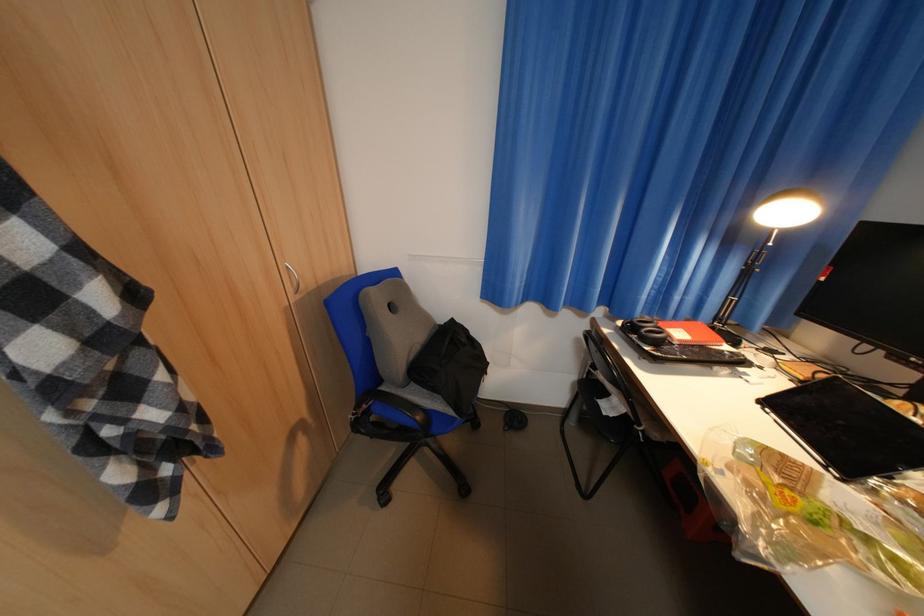
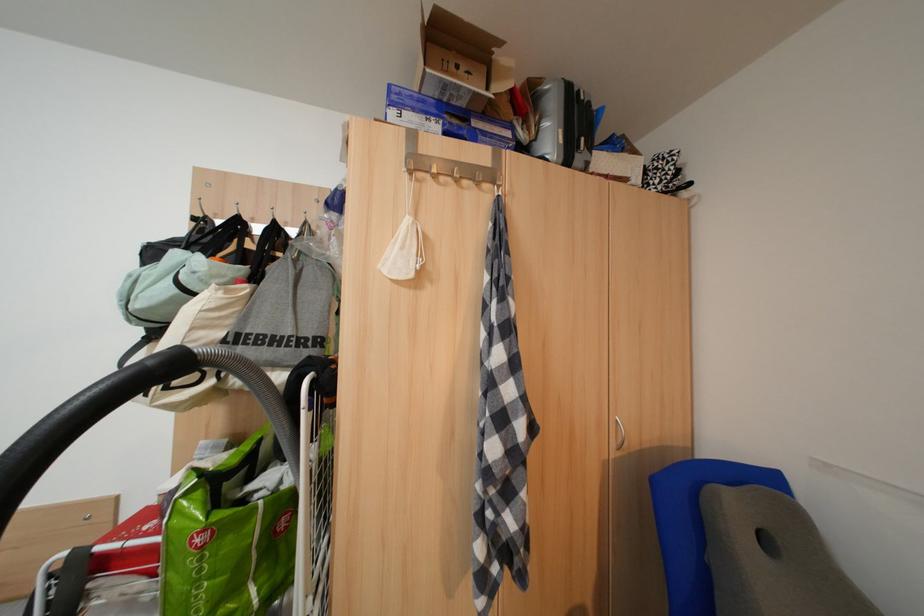
Question: The first image is from the beginning of the video and the second image is from the end. How did the camera likely rotate when shooting the video?

Choices:
 (A) Left
 (B) Right
 (C) Up
 (D) Down

Answer: (A)